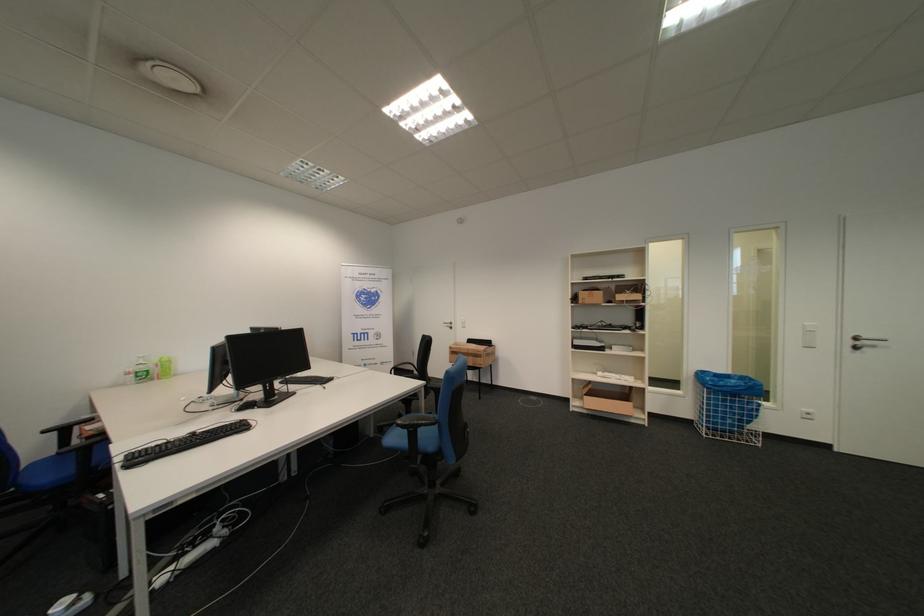
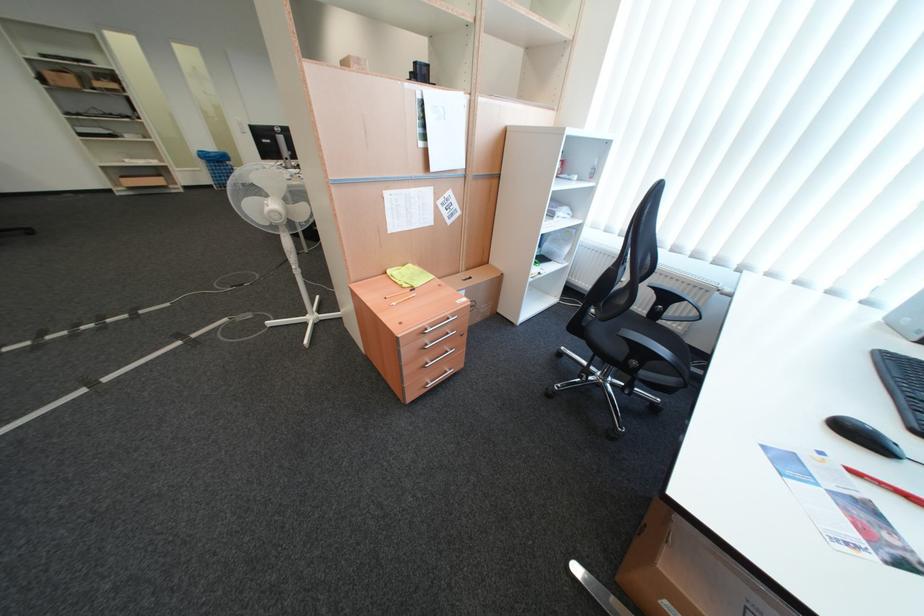
Find the pixel in the second image that matches point (736, 402) in the first image.

(227, 168)